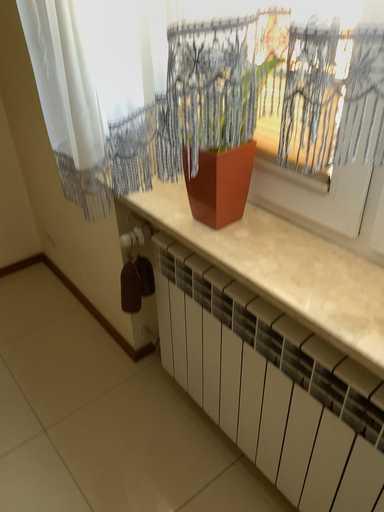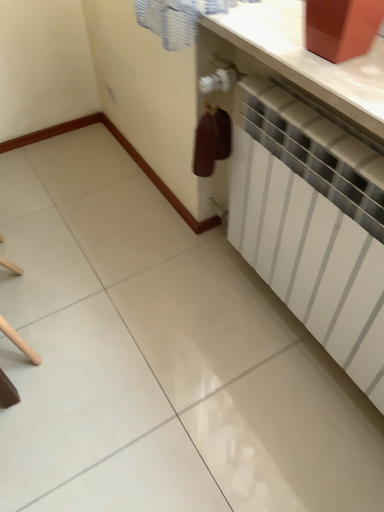
Question: Which way did the camera rotate in the video?

Choices:
 (A) rotated upward
 (B) rotated downward

Answer: (B)